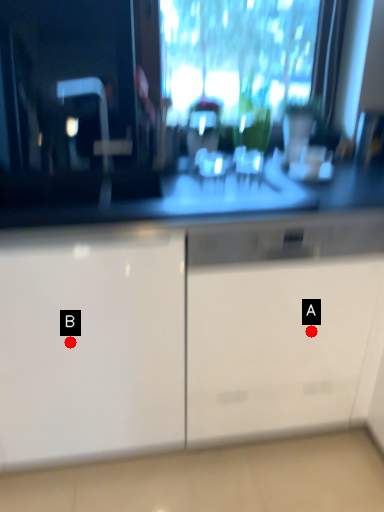
Question: Two points are circled on the image, labeled by A and B beside each circle. Which point appears closest to the camera in this image?

Choices:
 (A) A is closer
 (B) B is closer

Answer: (B)